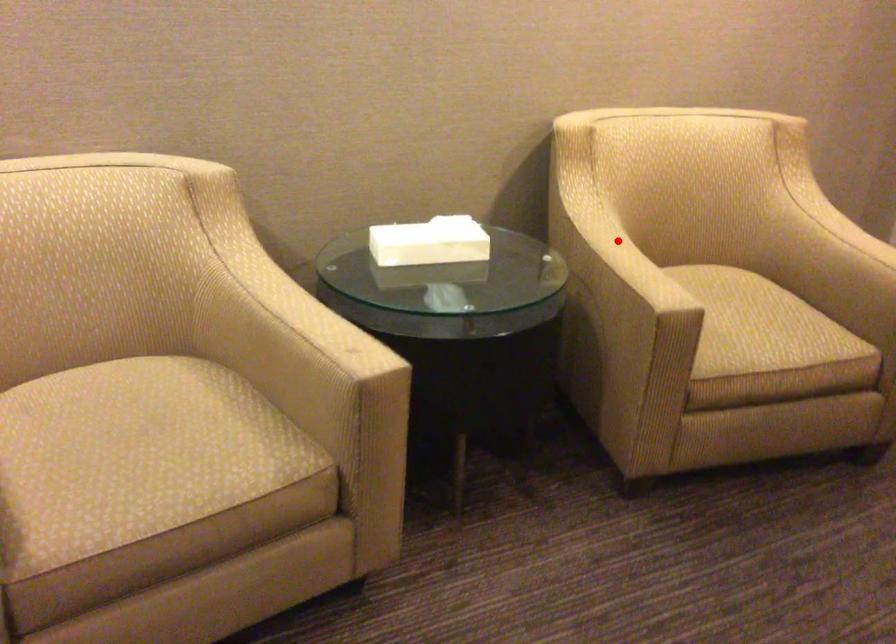
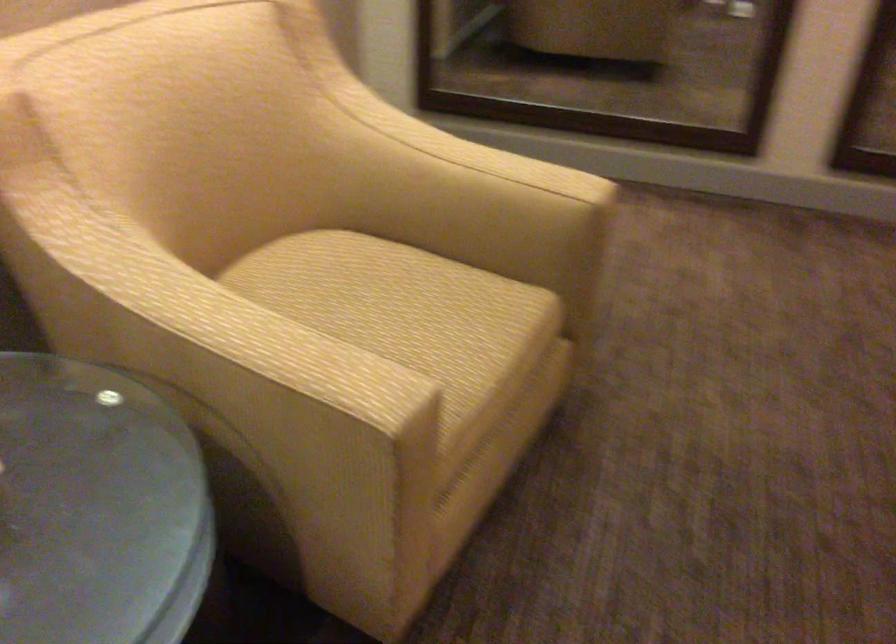
Question: I am providing you with two images of the same scene from different viewpoints. Image1 has a red point marked. In image2, the corresponding 3D location appears at what relative position? Reply with the corresponding letter.

Choices:
 (A) Closer
 (B) Farther

Answer: (A)